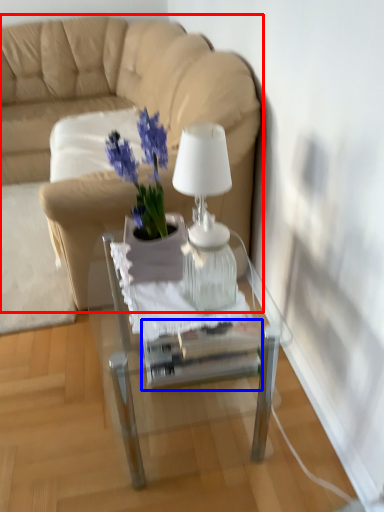
Question: Which of the following is the farthest to the observer, studio couch (highlighted by a red box) or glass box (highlighted by a blue box)?

Choices:
 (A) studio couch
 (B) glass box

Answer: (A)